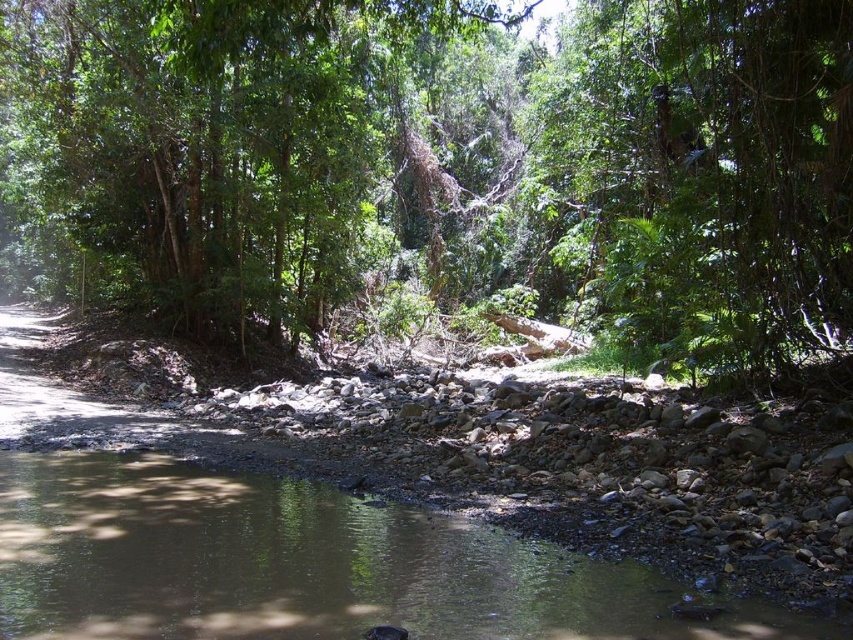
Question: Which object appears closest to the camera in this image?

Choices:
 (A) green leafy tree at center
 (B) brown gravel river at lower left

Answer: (B)

Question: Does green leafy tree at center appear under brown gravel river at lower left?

Choices:
 (A) yes
 (B) no

Answer: (B)

Question: Is green leafy tree at center in front of brown gravel river at lower left?

Choices:
 (A) yes
 (B) no

Answer: (B)

Question: Does green leafy tree at center appear over brown gravel river at lower left?

Choices:
 (A) yes
 (B) no

Answer: (A)